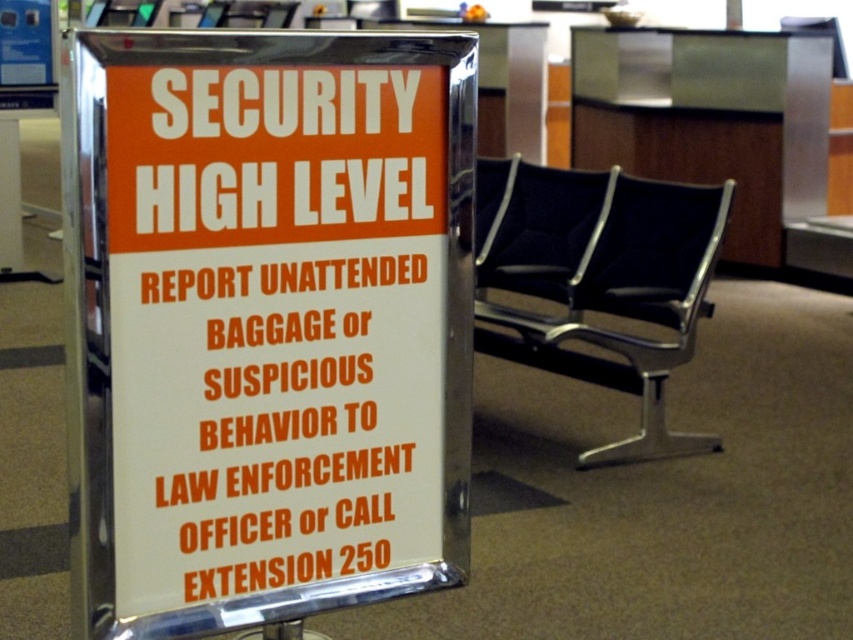
Is black fabric swivel chair at center to the right of metallic/reflective information desk at upper center from the viewer's perspective?

In fact, black fabric swivel chair at center is to the left of metallic/reflective information desk at upper center.

Can you confirm if black fabric swivel chair at center is smaller than metallic/reflective information desk at upper center?

Yes.

The image size is (853, 640). Describe the element at coordinates (605, 284) in the screenshot. I see `black fabric swivel chair at center` at that location.

Image resolution: width=853 pixels, height=640 pixels. In order to click on black fabric swivel chair at center in this screenshot , I will do `click(605, 284)`.

Between metallic signboard at center and metallic/reflective information desk at upper center, which one appears on the left side from the viewer's perspective?

From the viewer's perspective, metallic signboard at center appears more on the left side.

Where is `metallic signboard at center`? metallic signboard at center is located at coordinates (270, 323).

Does point (459, 502) come in front of point (601, 166)?

Yes, point (459, 502) is in front of point (601, 166).

You are a GUI agent. You are given a task and a screenshot of the screen. Output one action in this format:
    pyautogui.click(x=<x>, y=<y>)
    Task: Click on the metallic signboard at center
    This screenshot has height=640, width=853.
    Given the screenshot: What is the action you would take?
    pyautogui.click(x=270, y=323)

Does metallic/reflective information desk at upper center have a lesser height compared to dark blue fabric chair at center?

No.

Who is shorter, metallic/reflective information desk at upper center or dark blue fabric chair at center?

dark blue fabric chair at center

Is point (757, 77) less distant than point (515, 248)?

That is False.

Find the location of a particular element. The image size is (853, 640). metallic/reflective information desk at upper center is located at coordinates (709, 120).